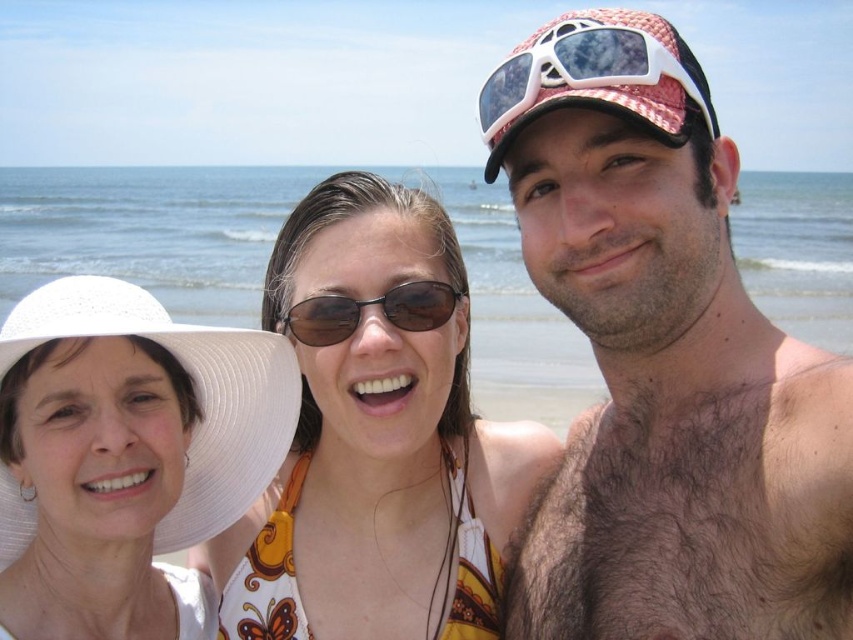
Measure the distance between white fabric hat at left and black plastic sunglasses at center.

white fabric hat at left is 1.27 meters from black plastic sunglasses at center.

From the picture: Does white fabric hat at left have a lesser height compared to black plastic sunglasses at center?

Indeed, white fabric hat at left has a lesser height compared to black plastic sunglasses at center.

Which is in front, point (122, 561) or point (288, 312)?

Point (122, 561)

The image size is (853, 640). I want to click on white fabric hat at left, so click(126, 458).

Is pink mesh cap at upper right wider than white fabric hat at left?

Incorrect, pink mesh cap at upper right's width does not surpass white fabric hat at left's.

Between pink mesh cap at upper right and white fabric hat at left, which one appears on the left side from the viewer's perspective?

white fabric hat at left is more to the left.

Is point (662, 621) less distant than point (77, 444)?

Yes, point (662, 621) is in front of point (77, 444).

Where is `pink mesh cap at upper right`? Image resolution: width=853 pixels, height=640 pixels. pink mesh cap at upper right is located at coordinates [x=663, y=362].

Who is positioned more to the left, white plastic sunglasses at upper center or black plastic sunglasses at center?

Positioned to the left is black plastic sunglasses at center.

Between white plastic sunglasses at upper center and black plastic sunglasses at center, which one appears on the right side from the viewer's perspective?

From the viewer's perspective, white plastic sunglasses at upper center appears more on the right side.

Is point (479, 99) more distant than point (352, 321)?

No, it is in front of (352, 321).

The image size is (853, 640). In order to click on white plastic sunglasses at upper center in this screenshot , I will do `click(579, 68)`.